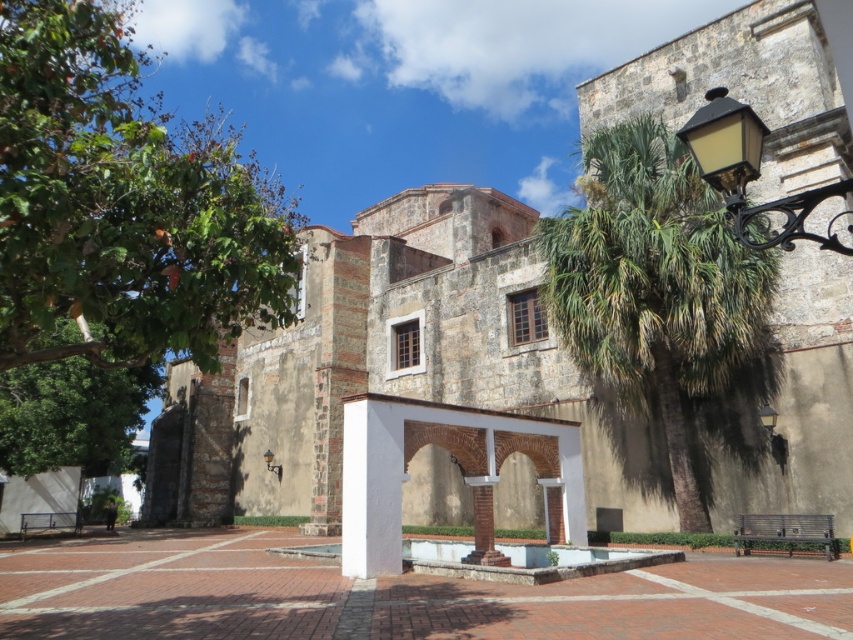
Question: Which point is closer to the camera?

Choices:
 (A) matte black lamp at center
 (B) green leafy tree at upper left

Answer: (B)

Question: Which object is farther from the camera taking this photo?

Choices:
 (A) green leafy tree at upper left
 (B) black wrought iron lamp post at upper right
 (C) matte black lamp at center

Answer: (C)

Question: Can you confirm if black wrought iron lamp post at upper right is wider than matte black lamp at center?

Choices:
 (A) no
 (B) yes

Answer: (B)

Question: Is black wrought iron lamp post at upper right closer to the viewer compared to matte black lamp at center?

Choices:
 (A) yes
 (B) no

Answer: (A)

Question: Among these objects, which one is farthest from the camera?

Choices:
 (A) matte black lamp at center
 (B) green leafy tree at upper left
 (C) green leafy palm at right
 (D) black wrought iron lamp post at upper right

Answer: (A)

Question: Does black wrought iron lamp post at upper right lie behind matte black lamp at center?

Choices:
 (A) yes
 (B) no

Answer: (B)